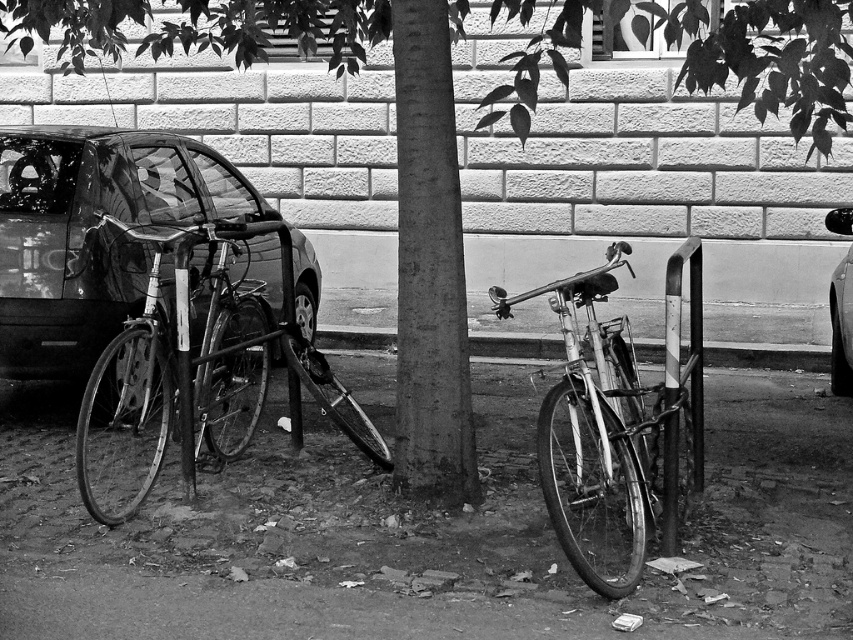
Question: Is glossy metallic car at left to the left of shiny metallic bicycle at left from the viewer's perspective?

Choices:
 (A) yes
 (B) no

Answer: (A)

Question: Does glossy metallic car at left appear on the left side of shiny metallic bicycle at left?

Choices:
 (A) no
 (B) yes

Answer: (B)

Question: Which point is farther to the camera?

Choices:
 (A) (254, 369)
 (B) (178, 163)

Answer: (A)

Question: Observing the image, what is the correct spatial positioning of glossy metallic car at left in reference to metallic silver car at right?

Choices:
 (A) above
 (B) below

Answer: (A)

Question: Which point is closer to the camera?

Choices:
 (A) (99, 356)
 (B) (846, 348)
 (C) (538, 440)

Answer: (C)

Question: Based on their relative distances, which object is nearer to the shiny metallic bicycle at left?

Choices:
 (A) shiny silver bicycle at center
 (B) metallic silver car at right
 (C) glossy metallic car at left

Answer: (C)